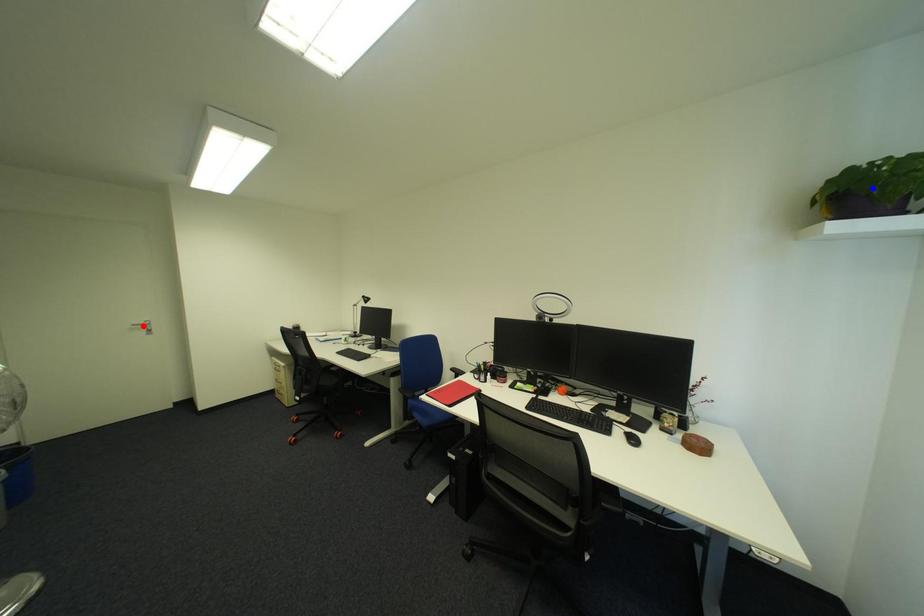
Question: Two points are marked on the image. Which point is closer to the camera?

Choices:
 (A) Blue point is closer.
 (B) Red point is closer.

Answer: (A)